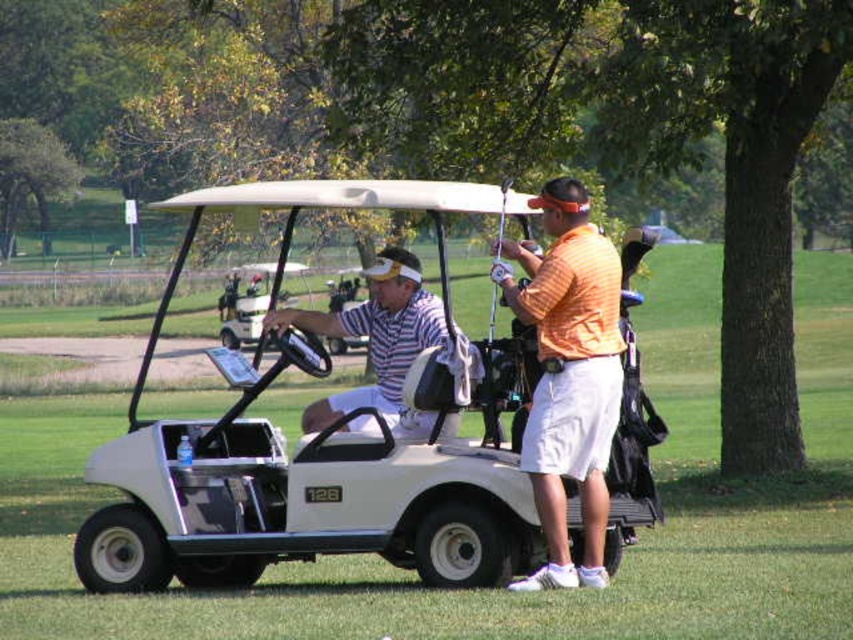
Can you confirm if white matte golf cart at center is wider than orange matte shirt at center?

Yes.

Can you confirm if white matte golf cart at center is taller than orange matte shirt at center?

Correct, white matte golf cart at center is much taller as orange matte shirt at center.

Who is more distant from viewer, (282, 180) or (502, 275)?

Point (282, 180)

I want to click on white matte golf cart at center, so click(x=323, y=442).

Can you confirm if orange matte shirt at center is bigger than striped cotton shirt at center?

Incorrect, orange matte shirt at center is not larger than striped cotton shirt at center.

Is point (537, 488) closer to viewer compared to point (329, 396)?

That is True.

Locate an element on the screen. orange matte shirt at center is located at coordinates (567, 376).

From the picture: Is white matte golf cart at center bigger than striped cotton shirt at center?

Correct, white matte golf cart at center is larger in size than striped cotton shirt at center.

Which is in front, point (483, 497) or point (447, 332)?

Point (483, 497) is in front.

Is point (271, 557) behind point (444, 321)?

No, (271, 557) is closer to viewer.

Where is `white matte golf cart at center`? This screenshot has height=640, width=853. white matte golf cart at center is located at coordinates (323, 442).